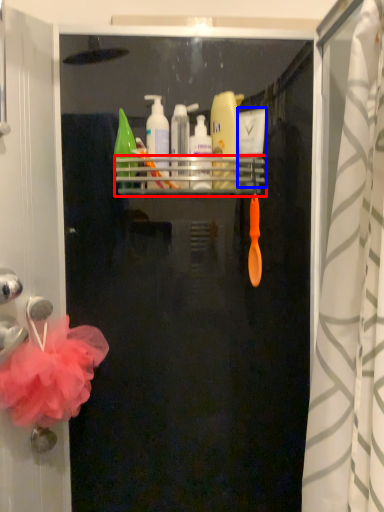
Question: Among these objects, which one is nearest to the camera, shelf (highlighted by a red box) or toiletry (highlighted by a blue box)?

Choices:
 (A) shelf
 (B) toiletry

Answer: (A)